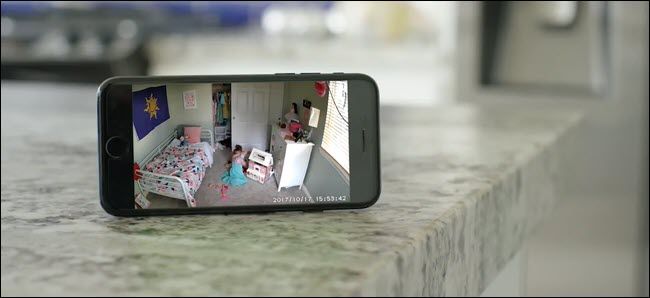
Find the location of a particular element. The height and width of the screenshot is (298, 650). polkadot comforter is located at coordinates (183, 161).